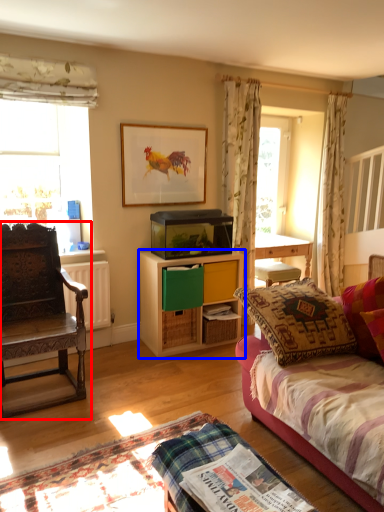
Question: Which object is further to the camera taking this photo, chair (highlighted by a red box) or cabinetry (highlighted by a blue box)?

Choices:
 (A) chair
 (B) cabinetry

Answer: (B)